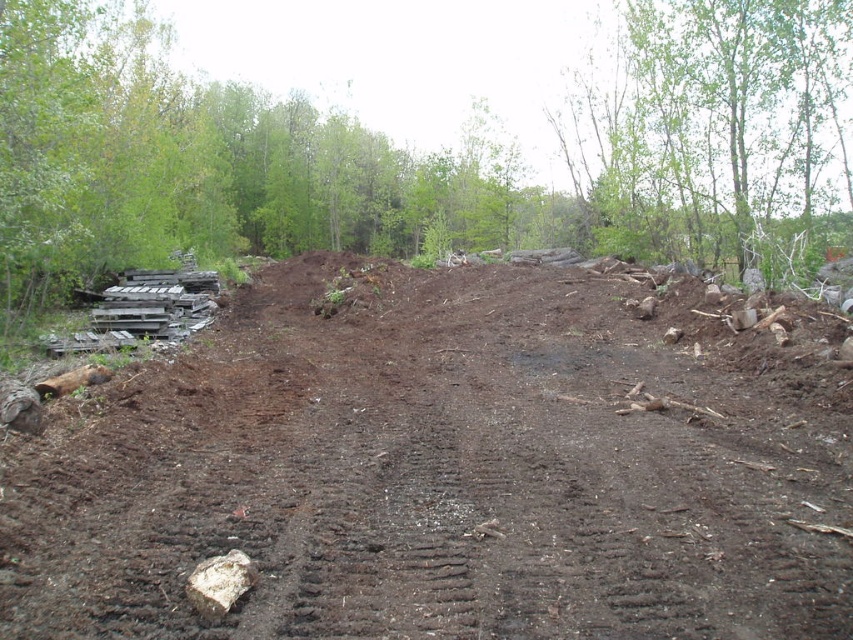
This screenshot has width=853, height=640. Describe the element at coordinates (712, 129) in the screenshot. I see `green leafy tree at upper right` at that location.

Between point (630, 56) and point (222, 556), which one is positioned behind?

The point (630, 56) is more distant.

This screenshot has width=853, height=640. Describe the element at coordinates (712, 129) in the screenshot. I see `green leafy tree at upper right` at that location.

Identify the location of green leafy tree at upper right. (712, 129).

Which is behind, point (701, 468) or point (227, 589)?

The point (701, 468) is more distant.

Who is more distant from viewer, (300, 541) or (200, 589)?

Positioned behind is point (300, 541).

Identify the location of dark brown soil at center. This screenshot has width=853, height=640. (431, 480).

Is dark brown soil at center below green leafy tree at upper right?

Correct, dark brown soil at center is located below green leafy tree at upper right.

Is dark brown soil at center positioned before green leafy tree at upper right?

Yes, dark brown soil at center is in front of green leafy tree at upper right.

Who is more forward, (821, 520) or (556, 128)?

Point (821, 520)

Find the location of a particular element. The image size is (853, 640). dark brown soil at center is located at coordinates (431, 480).